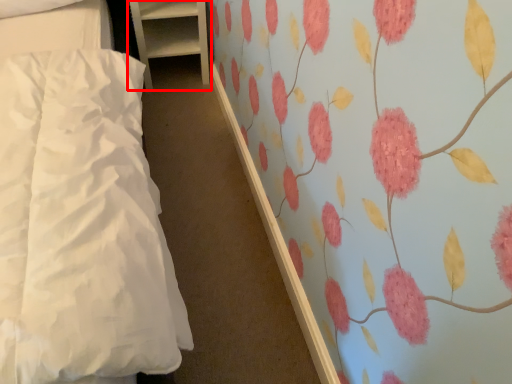
Question: From the image's perspective, where is furniture (annotated by the red box) located in relation to bed in the image?

Choices:
 (A) below
 (B) above

Answer: (B)